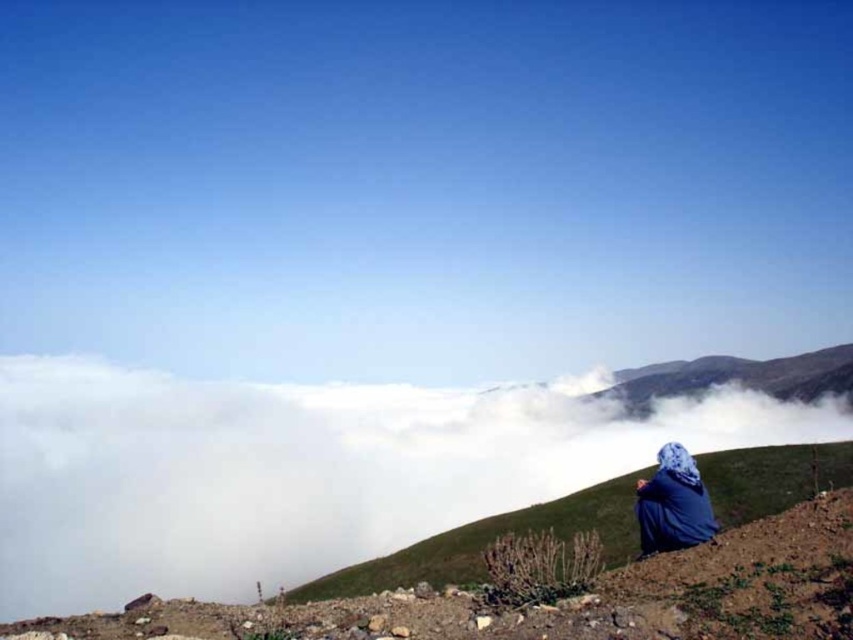
You are standing in the landscape and want to take a photo of the white fluffy cloud at upper center. If you move 0.1 units to the right along the horizontal axis, will the cloud still be in your camera frame?

The white fluffy cloud at upper center is located at point 0.736 on the horizontal axis. Moving 0.1 units to the right would place you at 0.836, which may move the cloud out of the frame depending on the camera angle and field of view. However, without specific camera parameters, it is impossible to determine definitively.

You are standing at the point marked by the coordinates point (x=300, y=470), which is the location of the white fluffy cloud at upper center. If you look directly downward, what would you see in the scene described?

The point (x=300, y=470) marks the white fluffy cloud at upper center, so looking directly downward from there would show the cloud itself.

You are standing at the point with coordinates point (647, 497) and want to walk to the point with coordinates point (450, 454). Which direction should you move to reach your destination?

To reach point (450, 454) from point (647, 497), you should move towards the lower left direction since point (450, 454) is behind point (647, 497).